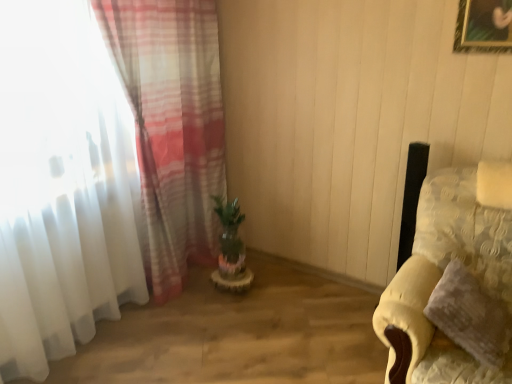
What do you see at coordinates (454, 283) in the screenshot? I see `yellow fabric couch at right` at bounding box center [454, 283].

What are the coordinates of `yellow fabric couch at right` in the screenshot? It's located at tap(454, 283).

This screenshot has width=512, height=384. I want to click on green matte plant at center, so click(229, 228).

From a real-world perspective, between green matte plant at center and fluffy yellow pillow at right, who is vertically higher?

fluffy yellow pillow at right is physically above.

Between green matte plant at center and fluffy yellow pillow at right, which one is positioned in front?

fluffy yellow pillow at right.

Do you think green matte plant at center is within fluffy yellow pillow at right, or outside of it?

The correct answer is: outside.

Is green matte plant at center oriented towards fluffy yellow pillow at right?

No, green matte plant at center is not oriented towards fluffy yellow pillow at right.

Based on the photo, considering the relative positions of fluffy yellow pillow at right and green matte plant at center in the image provided, is fluffy yellow pillow at right in front of green matte plant at center?

That is True.

Who is shorter, fluffy yellow pillow at right or green matte plant at center?

With less height is fluffy yellow pillow at right.

Is green matte plant at center a part of fluffy yellow pillow at right?

No, green matte plant at center is not surrounded by fluffy yellow pillow at right.

From a real-world perspective, is fluffy yellow pillow at right beneath yellow fabric couch at right?

Correct, in the physical world, fluffy yellow pillow at right is lower than yellow fabric couch at right.

Is fluffy yellow pillow at right facing away from yellow fabric couch at right?

Absolutely, fluffy yellow pillow at right is directed away from yellow fabric couch at right.

Is fluffy yellow pillow at right bigger or smaller than yellow fabric couch at right?

In the image, fluffy yellow pillow at right appears to be smaller than yellow fabric couch at right.

Would you say fluffy yellow pillow at right is inside or outside yellow fabric couch at right?

fluffy yellow pillow at right is spatially positioned inside yellow fabric couch at right.

Is translucent fabric curtain at left facing away from green matte plant at center?

Yes, translucent fabric curtain at left's orientation is away from green matte plant at center.

Do you think translucent fabric curtain at left is within green matte plant at center, or outside of it?

translucent fabric curtain at left is not enclosed by green matte plant at center.

Considering the relative sizes of translucent fabric curtain at left and green matte plant at center in the image provided, is translucent fabric curtain at left thinner than green matte plant at center?

In fact, translucent fabric curtain at left might be wider than green matte plant at center.

Is translucent fabric curtain at left to the left of green matte plant at center from the viewer's perspective?

Indeed, translucent fabric curtain at left is positioned on the left side of green matte plant at center.

Is yellow fabric couch at right wider than green matte plant at center?

Indeed, yellow fabric couch at right has a greater width compared to green matte plant at center.

Between yellow fabric couch at right and green matte plant at center, which one has larger size?

yellow fabric couch at right is bigger.

Where is `furniture above the green matte plant at center (from a real-world perspective)`? furniture above the green matte plant at center (from a real-world perspective) is located at coordinates (454, 283).

From the picture: From a real-world perspective, is yellow fabric couch at right positioned above or below fluffy yellow pillow at right?

In terms of real-world spatial position, yellow fabric couch at right is above fluffy yellow pillow at right.

Considering the positions of points (416, 310) and (483, 324), is point (416, 310) farther from camera compared to point (483, 324)?

That is True.

Consider the image. From the image's perspective, relative to fluffy yellow pillow at right, is yellow fabric couch at right above or below?

From the image's perspective, yellow fabric couch at right appears above fluffy yellow pillow at right.

Which is correct: green matte plant at center is inside translucent fabric curtain at left, or outside of it?

green matte plant at center is spatially situated outside translucent fabric curtain at left.

Based on the photo, is green matte plant at center far away from translucent fabric curtain at left?

No, there isn't a large distance between green matte plant at center and translucent fabric curtain at left.

From a real-world perspective, which is physically above, green matte plant at center or translucent fabric curtain at left?

In real-world perspective, translucent fabric curtain at left is above.

In order to click on pillow located on the right of green matte plant at center in this screenshot , I will do `click(470, 315)`.

Image resolution: width=512 pixels, height=384 pixels. What are the coordinates of `pillow above the green matte plant at center (from a real-world perspective)` in the screenshot? It's located at pyautogui.click(x=470, y=315).

From the picture: Looking at the image, which one is located closer to fluffy yellow pillow at right, translucent fabric curtain at left or yellow fabric couch at right?

yellow fabric couch at right lies closer to fluffy yellow pillow at right than the other object.

From the image, which object appears to be farther from yellow fabric couch at right, fluffy yellow pillow at right or green matte plant at center?

Among the two, green matte plant at center is located further to yellow fabric couch at right.

Estimate the real-world distances between objects in this image. Which object is further from fluffy yellow pillow at right, green matte plant at center or translucent fabric curtain at left?

The object further to fluffy yellow pillow at right is translucent fabric curtain at left.

Looking at the image, which one is located closer to translucent fabric curtain at left, green matte plant at center or fluffy yellow pillow at right?

The object closer to translucent fabric curtain at left is green matte plant at center.

Looking at the image, which one is located closer to yellow fabric couch at right, translucent fabric curtain at left or fluffy yellow pillow at right?

Among the two, fluffy yellow pillow at right is located nearer to yellow fabric couch at right.

Based on the photo, estimate the real-world distances between objects in this image. Which object is closer to green matte plant at center, yellow fabric couch at right or fluffy yellow pillow at right?

yellow fabric couch at right lies closer to green matte plant at center than the other object.

Which object lies further to the anchor point yellow fabric couch at right, fluffy yellow pillow at right or translucent fabric curtain at left?

Based on the image, translucent fabric curtain at left appears to be further to yellow fabric couch at right.

From the image, which object appears to be farther from fluffy yellow pillow at right, green matte plant at center or yellow fabric couch at right?

Based on the image, green matte plant at center appears to be further to fluffy yellow pillow at right.

Find the location of a particular element. This screenshot has width=512, height=384. plant between translucent fabric curtain at left and yellow fabric couch at right in the horizontal direction is located at coordinates (229, 228).

At what (x,y) coordinates should I click in order to perform the action: click on pillow between translucent fabric curtain at left and yellow fabric couch at right in the horizontal direction. Please return your answer as a coordinate pair (x, y). Looking at the image, I should click on (470, 315).

Find the location of a particular element. Image resolution: width=512 pixels, height=384 pixels. pillow between yellow fabric couch at right and green matte plant at center along the z-axis is located at coordinates (470, 315).

Locate an element on the screen. The image size is (512, 384). plant between translucent fabric curtain at left and fluffy yellow pillow at right in the horizontal direction is located at coordinates (229, 228).